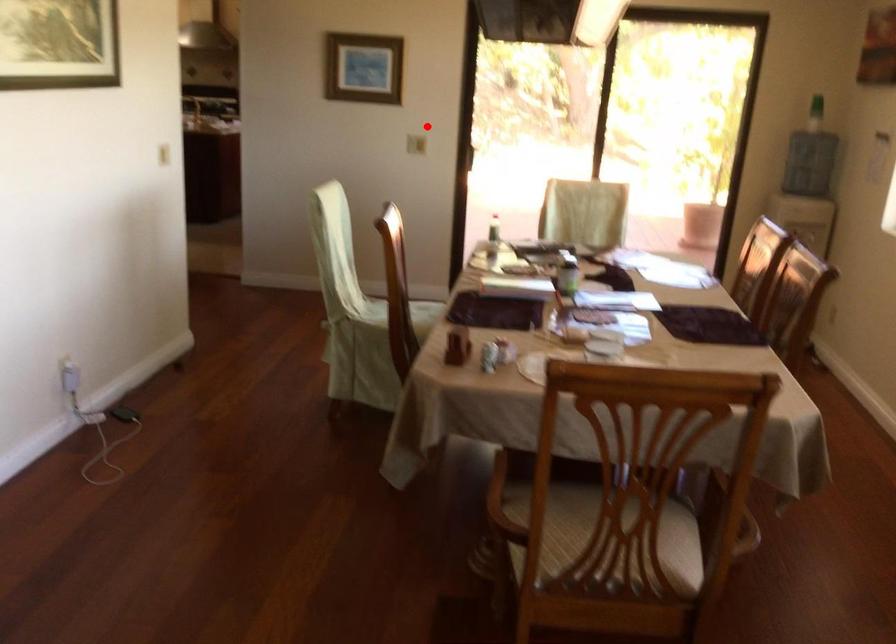
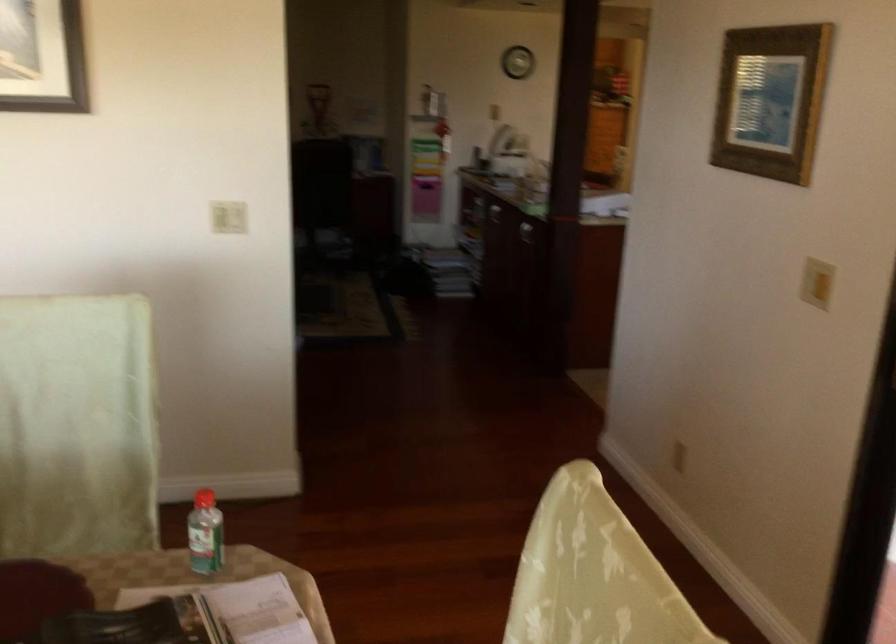
Find the pixel in the second image that matches the highlighted location in the first image.

(816, 283)